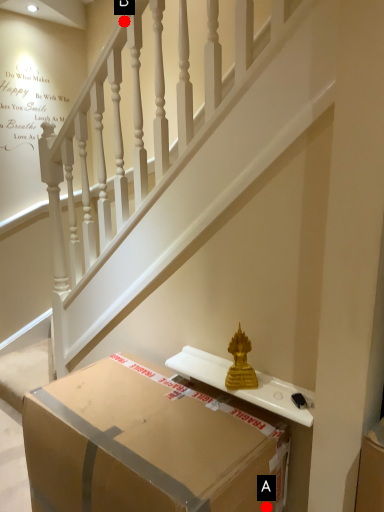
Question: Two points are circled on the image, labeled by A and B beside each circle. Which point is further to the camera?

Choices:
 (A) A is further
 (B) B is further

Answer: (B)